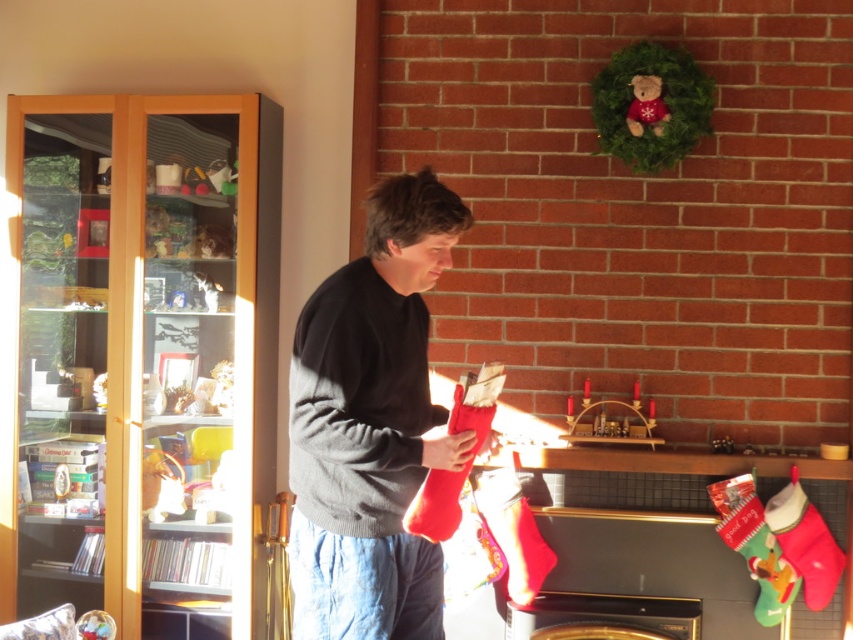
You are a delivery person who needs to place a large package on the wooden bookshelf at left or the dark gray sweater at center. Based on their sizes, which location can accommodate the package?

The wooden bookshelf at left is bigger than the dark gray sweater at center, so the wooden bookshelf at left can accommodate the large package.

You are a delivery person who needs to place a package that is 5 feet long between the wooden bookshelf at left and the dark gray sweater at center. Can you fit the package between them without bending it?

The wooden bookshelf at left is 4.98 feet from the dark gray sweater at center, so the package cannot be placed between them without bending it since the distance is slightly less than the package length.

You are an interior designer assessing the layout of this room. You notice the dark gray sweater at center and the wooden bookshelf at left. Based on their positions, which object is closer to the viewer?

The wooden bookshelf at left is closer to the viewer because the dark gray sweater at center is positioned behind it.